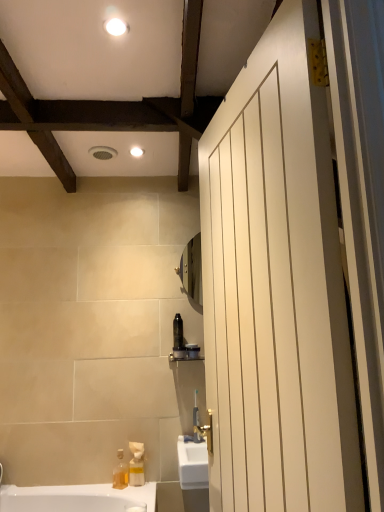
Question: From the image's perspective, is white matte door at right over white glossy light fixture at upper center, the first light fixture positioned from the back?

Choices:
 (A) yes
 (B) no

Answer: (B)

Question: Can you confirm if white matte door at right is positioned to the right of white glossy light fixture at upper center, the 2th light fixture viewed from the top?

Choices:
 (A) yes
 (B) no

Answer: (A)

Question: From a real-world perspective, does white matte door at right sit lower than white glossy light fixture at upper center, which is the 1th light fixture in bottom-to-top order?

Choices:
 (A) no
 (B) yes

Answer: (B)

Question: Considering the relative positions of white matte door at right and white glossy light fixture at upper center, positioned as the second light fixture in front-to-back order, in the image provided, is white matte door at right to the left of white glossy light fixture at upper center, positioned as the second light fixture in front-to-back order, from the viewer's perspective?

Choices:
 (A) yes
 (B) no

Answer: (B)

Question: From the image's perspective, is white matte door at right located beneath white glossy light fixture at upper center, the first light fixture positioned from the back?

Choices:
 (A) no
 (B) yes

Answer: (B)

Question: Is white glossy light fixture at upper center, the second light fixture positioned from the back, in front of or behind matte black toothbrush at center in the image?

Choices:
 (A) front
 (B) behind

Answer: (A)

Question: From their relative heights in the image, would you say white glossy light fixture at upper center, placed as the second light fixture when sorted from bottom to top, is taller or shorter than matte black toothbrush at center?

Choices:
 (A) tall
 (B) short

Answer: (B)

Question: Looking at their shapes, would you say white glossy light fixture at upper center, placed as the second light fixture when sorted from bottom to top, is wider or thinner than matte black toothbrush at center?

Choices:
 (A) thin
 (B) wide

Answer: (B)

Question: Visually, is white glossy light fixture at upper center, which is the first light fixture from top to bottom, positioned to the left or to the right of matte black toothbrush at center?

Choices:
 (A) left
 (B) right

Answer: (A)

Question: From a real-world perspective, is matte black toothbrush at center above or below white glossy light fixture at upper center, marked as the first light fixture in a front-to-back arrangement?

Choices:
 (A) below
 (B) above

Answer: (A)

Question: In the image, is matte black toothbrush at center on the left side or the right side of white glossy light fixture at upper center, which is the first light fixture from top to bottom?

Choices:
 (A) right
 (B) left

Answer: (A)

Question: From the image's perspective, is matte black toothbrush at center located above or below white glossy light fixture at upper center, marked as the first light fixture in a front-to-back arrangement?

Choices:
 (A) above
 (B) below

Answer: (B)

Question: Is matte black toothbrush at center bigger or smaller than white glossy light fixture at upper center, the second light fixture positioned from the back?

Choices:
 (A) big
 (B) small

Answer: (A)

Question: In terms of width, does translucent plastic soap dispenser at lower left look wider or thinner when compared to matte black toothbrush at center?

Choices:
 (A) wide
 (B) thin

Answer: (B)

Question: Is translucent plastic soap dispenser at lower left situated inside matte black toothbrush at center or outside?

Choices:
 (A) outside
 (B) inside

Answer: (A)